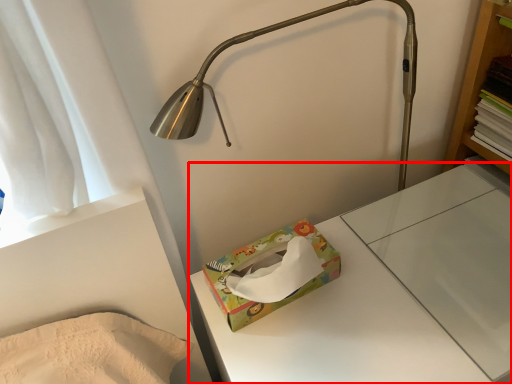
Question: From the image's perspective, where is changing table (annotated by the red box) located relative to package?

Choices:
 (A) below
 (B) above

Answer: (A)